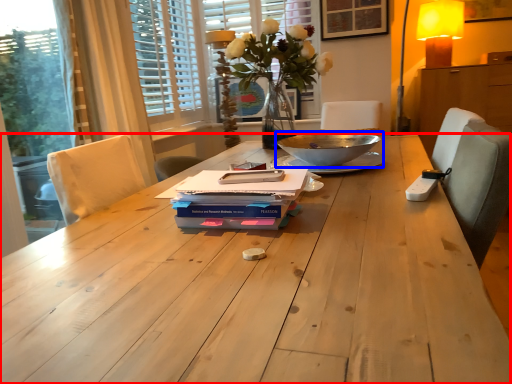
Question: Which point is further to the camera, table (highlighted by a red box) or bowl (highlighted by a blue box)?

Choices:
 (A) table
 (B) bowl

Answer: (B)